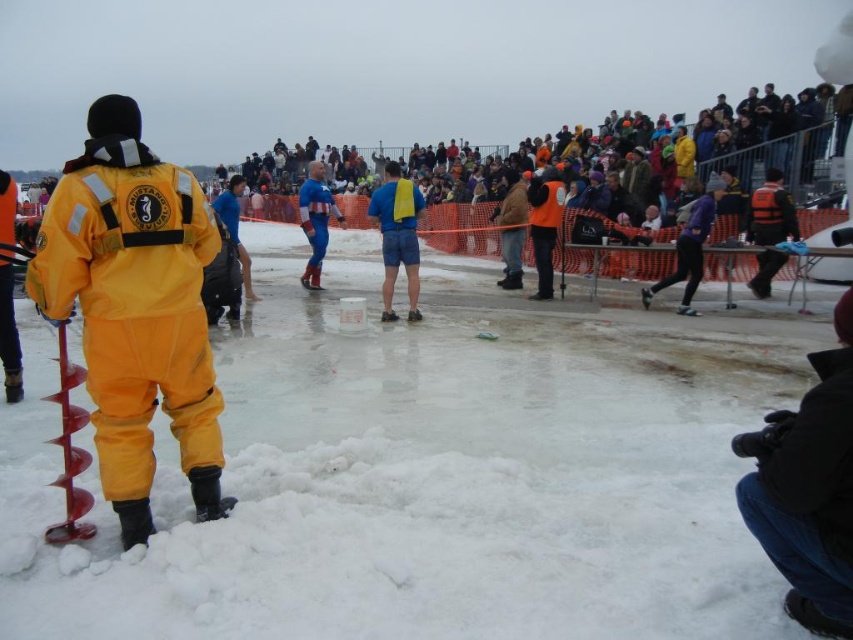
You are organizing a winter event and need to arrange participants based on their clothing. If the orange matte jacket at center is to the right of the blue fabric shirt at center, which participant should be placed first when moving from left to right?

The blue fabric shirt at center should be placed first when moving from left to right because the orange matte jacket at center is to its right.

You are at the frozen lake and want to retrieve your black fleece jacket at lower right. Which direction should you move from your current position at the center of the lake to reach it?

The black fleece jacket at lower right is located at point 0.766 on the x and 0.948 on the y coordinate. Since the coordinates are relative to the image, moving towards the lower right direction from the center will lead you to the jacket.

You are a participant in the winter event and need to locate your orange matte jacket at center. According to the coordinates provided, where should you look to find it?

The orange matte jacket at center is located at coordinates point (544, 225).